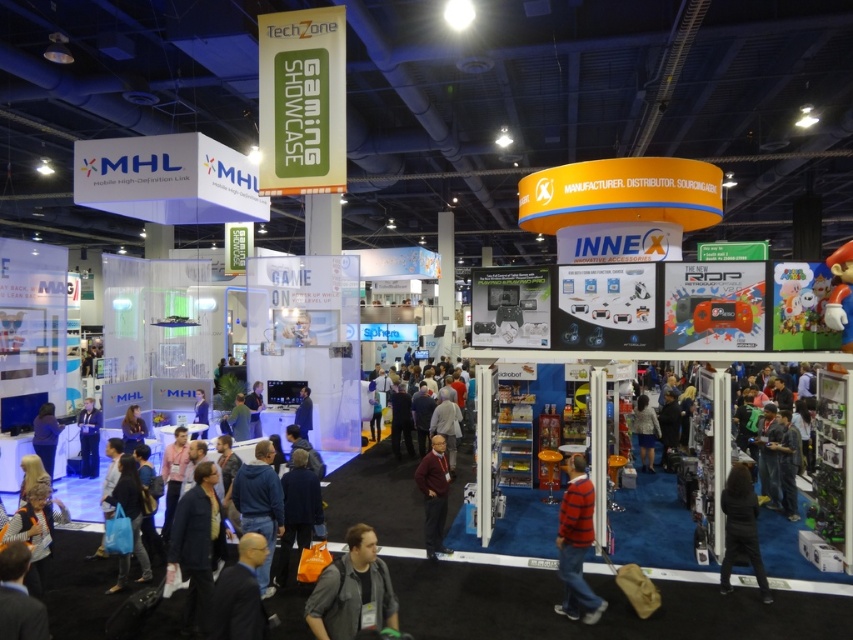
Is maroon fabric shirt at center above matte blue shirt at center?

Incorrect, maroon fabric shirt at center is not positioned above matte blue shirt at center.

Who is positioned more to the right, maroon fabric shirt at center or matte blue shirt at center?

From the viewer's perspective, maroon fabric shirt at center appears more on the right side.

Is point (428, 515) closer to viewer compared to point (143, 428)?

Yes, it is.

The image size is (853, 640). Identify the location of maroon fabric shirt at center. (434, 493).

Who is shorter, matte blue shirt at center or dark blue shirt at center?

matte blue shirt at center

Does point (141, 440) come behind point (310, 406)?

No.

At what (x,y) coordinates should I click in order to perform the action: click on matte blue shirt at center. Please return your answer as a coordinate pair (x, y). Looking at the image, I should click on (132, 428).

From the picture: Between blue fabric at lower left and dark blue shirt at center, which one is positioned lower?

blue fabric at lower left

Is point (45, 420) positioned behind point (300, 436)?

Yes, point (45, 420) is behind point (300, 436).

Who is more forward, (33,442) or (300,426)?

Positioned in front is point (33,442).

Locate an element on the screen. The height and width of the screenshot is (640, 853). blue fabric at lower left is located at coordinates (45, 435).